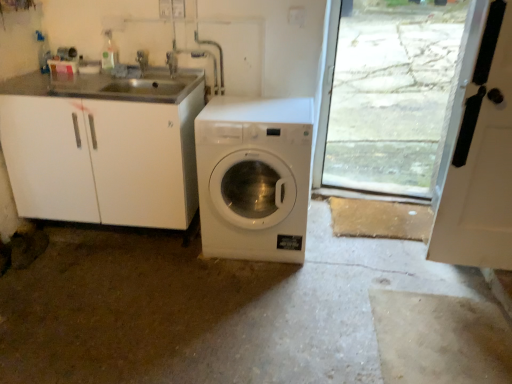
Question: Considering the relative positions of brushed metal faucet at upper center, which is counted as the first faucet, starting from the right, and brushed metal faucet at upper center, the first faucet from the left, in the image provided, is brushed metal faucet at upper center, which is counted as the first faucet, starting from the right, behind brushed metal faucet at upper center, the first faucet from the left,?

Choices:
 (A) no
 (B) yes

Answer: (A)

Question: Could you tell me if brushed metal faucet at upper center, which is counted as the second faucet, starting from the left, is facing brushed metal faucet at upper center, the first faucet from the left?

Choices:
 (A) yes
 (B) no

Answer: (B)

Question: Considering the relative sizes of brushed metal faucet at upper center, which is counted as the second faucet, starting from the left, and brushed metal faucet at upper center, the second faucet in the right-to-left sequence, in the image provided, is brushed metal faucet at upper center, which is counted as the second faucet, starting from the left, taller than brushed metal faucet at upper center, the second faucet in the right-to-left sequence,?

Choices:
 (A) yes
 (B) no

Answer: (B)

Question: Is brushed metal faucet at upper center, which is counted as the second faucet, starting from the left, not near brushed metal faucet at upper center, the second faucet in the right-to-left sequence?

Choices:
 (A) no
 (B) yes

Answer: (A)

Question: Can you confirm if brushed metal faucet at upper center, which is counted as the first faucet, starting from the right, is positioned to the right of brushed metal faucet at upper center, the first faucet from the left?

Choices:
 (A) no
 (B) yes

Answer: (B)

Question: Can you confirm if brushed metal faucet at upper center, which is counted as the first faucet, starting from the right, is smaller than brushed metal faucet at upper center, the second faucet in the right-to-left sequence?

Choices:
 (A) no
 (B) yes

Answer: (B)

Question: Is white matte door at right located within brushed metal faucet at upper center, which is counted as the second faucet, starting from the left?

Choices:
 (A) no
 (B) yes

Answer: (A)

Question: Is brushed metal faucet at upper center, which is counted as the second faucet, starting from the left, at the left side of white matte door at right?

Choices:
 (A) no
 (B) yes

Answer: (B)

Question: Is brushed metal faucet at upper center, which is counted as the first faucet, starting from the right, located outside white matte door at right?

Choices:
 (A) no
 (B) yes

Answer: (B)

Question: From a real-world perspective, is brushed metal faucet at upper center, which is counted as the second faucet, starting from the left, positioned over white matte door at right based on gravity?

Choices:
 (A) yes
 (B) no

Answer: (A)

Question: Can you confirm if brushed metal faucet at upper center, which is counted as the second faucet, starting from the left, is positioned to the right of white matte door at right?

Choices:
 (A) no
 (B) yes

Answer: (A)

Question: Could you tell me if brushed metal faucet at upper center, which is counted as the second faucet, starting from the left, is turned towards white matte door at right?

Choices:
 (A) yes
 (B) no

Answer: (B)

Question: From the image's perspective, is brushed metal faucet at upper center, the second faucet in the right-to-left sequence, beneath brushed metal faucet at upper center, which is counted as the second faucet, starting from the left?

Choices:
 (A) no
 (B) yes

Answer: (A)